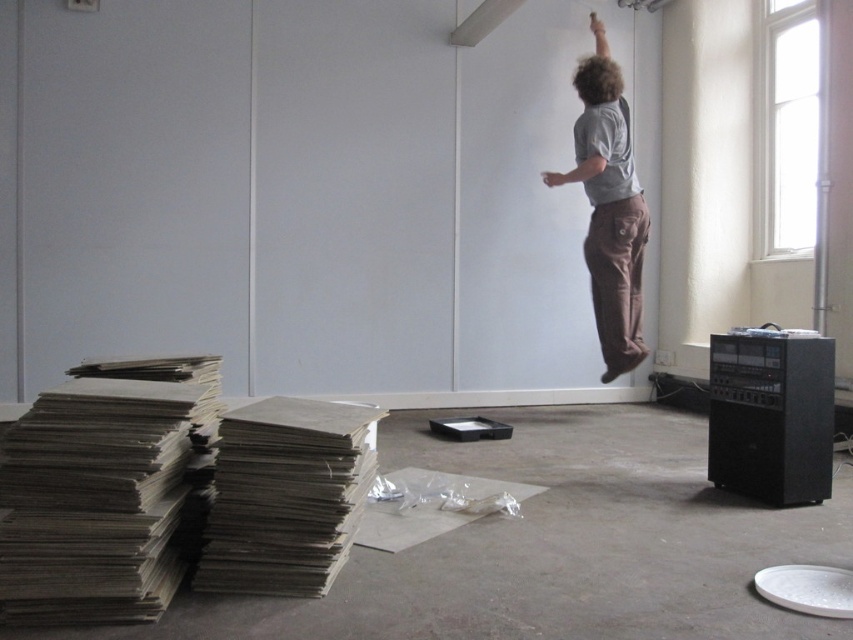
Is gray cardboard stack at lower left behind brown cotton pants at upper right?

No, gray cardboard stack at lower left is in front of brown cotton pants at upper right.

This screenshot has width=853, height=640. What do you see at coordinates (102, 490) in the screenshot?
I see `gray cardboard stack at lower left` at bounding box center [102, 490].

Find the location of a particular element. The height and width of the screenshot is (640, 853). gray cardboard stack at lower left is located at coordinates (102, 490).

Where is `gray cardboard stack at lower left`? Image resolution: width=853 pixels, height=640 pixels. gray cardboard stack at lower left is located at coordinates (102, 490).